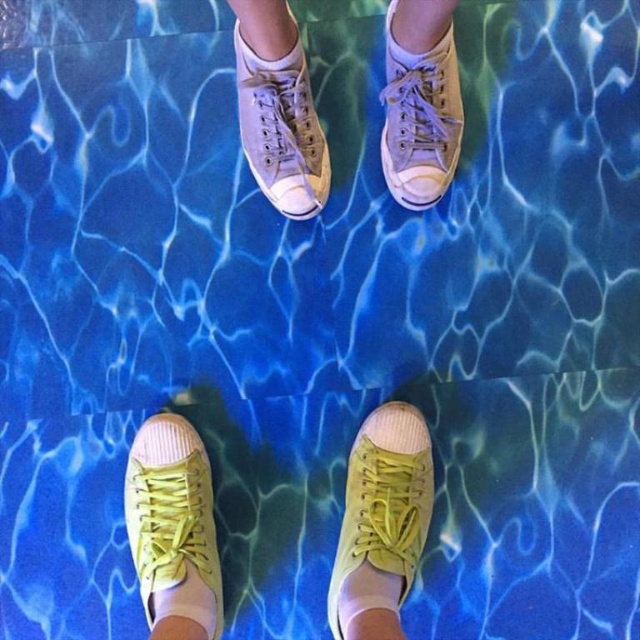
Who is lower down, light beige canvas shoes at center or white cotton sock at lower center?

white cotton sock at lower center is lower down.

Between light beige canvas shoes at center and white cotton sock at lower center, which one has more height?

light beige canvas shoes at center

You are a GUI agent. You are given a task and a screenshot of the screen. Output one action in this format:
    pyautogui.click(x=<x>, y=<y>)
    Task: Click on the light beige canvas shoes at center
    
    Given the screenshot: What is the action you would take?
    [x=278, y=108]

The width and height of the screenshot is (640, 640). In order to click on matte canvas shoe at upper center in this screenshot , I will do `click(282, 129)`.

Does light gray canvas shoe at upper center have a larger size compared to white cotton sock at lower center?

Indeed, light gray canvas shoe at upper center has a larger size compared to white cotton sock at lower center.

Which is in front, point (451, 96) or point (371, 627)?

Point (371, 627) is in front.

Is point (444, 77) positioned after point (364, 628)?

Yes.

Locate an element on the screen. light gray canvas shoe at upper center is located at coordinates (420, 120).